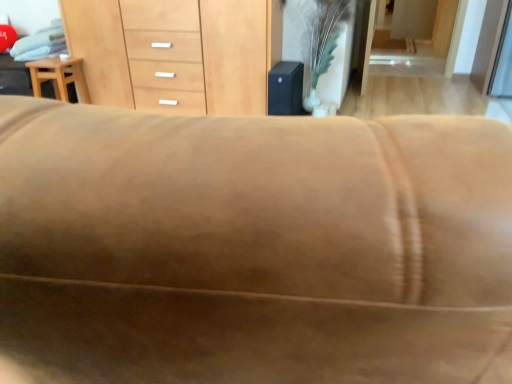
Question: From a real-world perspective, is light brown wood stool at left over light brown wood chest of drawers at center?

Choices:
 (A) no
 (B) yes

Answer: (A)

Question: Is light brown wood stool at left thinner than light brown wood chest of drawers at center?

Choices:
 (A) no
 (B) yes

Answer: (B)

Question: Does light brown wood stool at left have a greater width compared to light brown wood chest of drawers at center?

Choices:
 (A) no
 (B) yes

Answer: (A)

Question: Is light brown wood stool at left to the right of light brown wood chest of drawers at center from the viewer's perspective?

Choices:
 (A) yes
 (B) no

Answer: (B)

Question: Is light brown wood chest of drawers at center surrounded by light brown wood stool at left?

Choices:
 (A) no
 (B) yes

Answer: (A)

Question: Is the depth of light brown wood stool at left greater than that of light brown wood chest of drawers at center?

Choices:
 (A) no
 (B) yes

Answer: (B)

Question: Is light brown wood chest of drawers at center further to the viewer compared to light brown wood stool at left?

Choices:
 (A) no
 (B) yes

Answer: (A)

Question: Can you confirm if light brown wood chest of drawers at center is thinner than light brown wood stool at left?

Choices:
 (A) no
 (B) yes

Answer: (A)

Question: Considering the relative positions of light brown wood chest of drawers at center and light brown wood stool at left in the image provided, is light brown wood chest of drawers at center in front of light brown wood stool at left?

Choices:
 (A) yes
 (B) no

Answer: (A)

Question: From the image's perspective, is light brown wood chest of drawers at center beneath light brown wood stool at left?

Choices:
 (A) yes
 (B) no

Answer: (B)

Question: Is light brown wood chest of drawers at center taller than light brown wood stool at left?

Choices:
 (A) no
 (B) yes

Answer: (B)

Question: Are light brown wood chest of drawers at center and light brown wood stool at left making contact?

Choices:
 (A) yes
 (B) no

Answer: (B)

Question: Considering the relative sizes of green leafy plant at center and light brown wood stool at left in the image provided, is green leafy plant at center smaller than light brown wood stool at left?

Choices:
 (A) no
 (B) yes

Answer: (A)